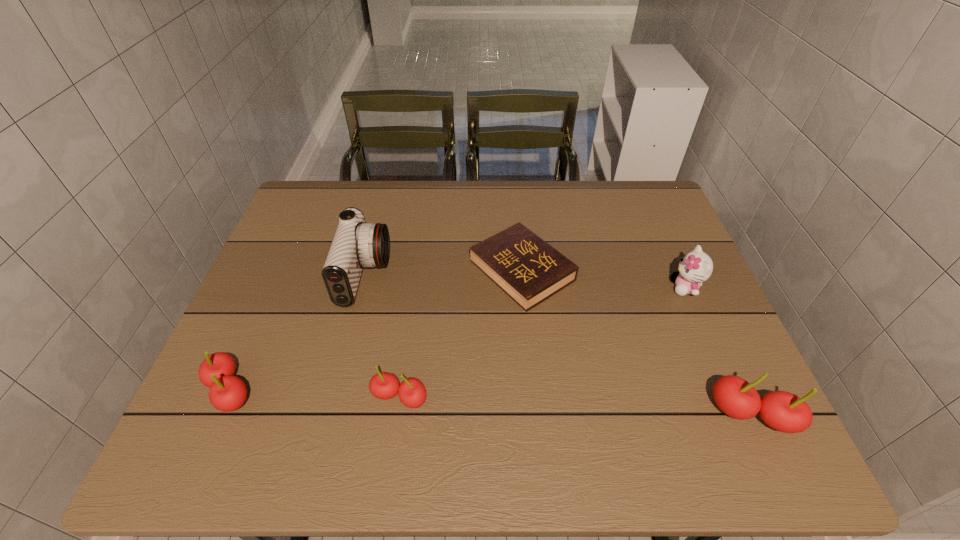
The height and width of the screenshot is (540, 960). I want to click on vacant point located between the second tallest cherry and the camcorder, so click(298, 333).

At what (x,y) coordinates should I click in order to perform the action: click on vacant region between the rightmost cherry and the second shortest cherry. Please return your answer as a coordinate pair (x, y). The height and width of the screenshot is (540, 960). Looking at the image, I should click on (492, 402).

Identify the location of free space between the leftmost object and the shortest object. (376, 330).

You are a GUI agent. You are given a task and a screenshot of the screen. Output one action in this format:
    pyautogui.click(x=<x>, y=<y>)
    Task: Click on the free spot between the hardback book and the shortest cherry
    This screenshot has width=960, height=540.
    Given the screenshot: What is the action you would take?
    pyautogui.click(x=461, y=334)

Find the location of a particular element. The width and height of the screenshot is (960, 540). empty space between the kitten and the fourth object from left to right is located at coordinates (604, 279).

Identify the location of the fourth closest object to the kitten. (356, 244).

The width and height of the screenshot is (960, 540). Find the location of `object that ranks as the second closest to the camcorder`. object that ranks as the second closest to the camcorder is located at coordinates (412, 393).

Image resolution: width=960 pixels, height=540 pixels. Find the location of `cherry that is the second closest one to the kitten`. cherry that is the second closest one to the kitten is located at coordinates [412, 393].

In order to click on the second closest cherry relative to the kitten in this screenshot , I will do `click(412, 393)`.

Where is `free space that satisfies the following two spatial constraints: 1. on the surface of the camcorder; 2. on the back side of the second cherry from left to right`? free space that satisfies the following two spatial constraints: 1. on the surface of the camcorder; 2. on the back side of the second cherry from left to right is located at coordinates (334, 397).